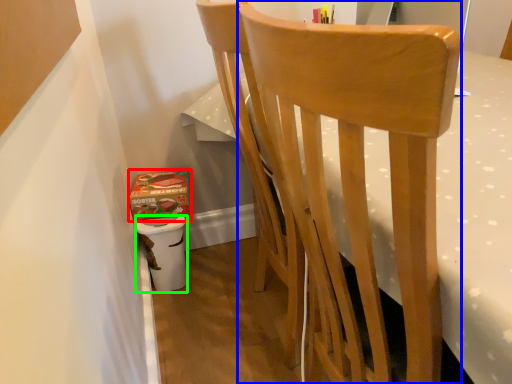
Question: Which object is the closest to the box (highlighted by a red box)? Choose among these: chair (highlighted by a blue box) or potty (highlighted by a green box).

Choices:
 (A) chair
 (B) potty

Answer: (B)